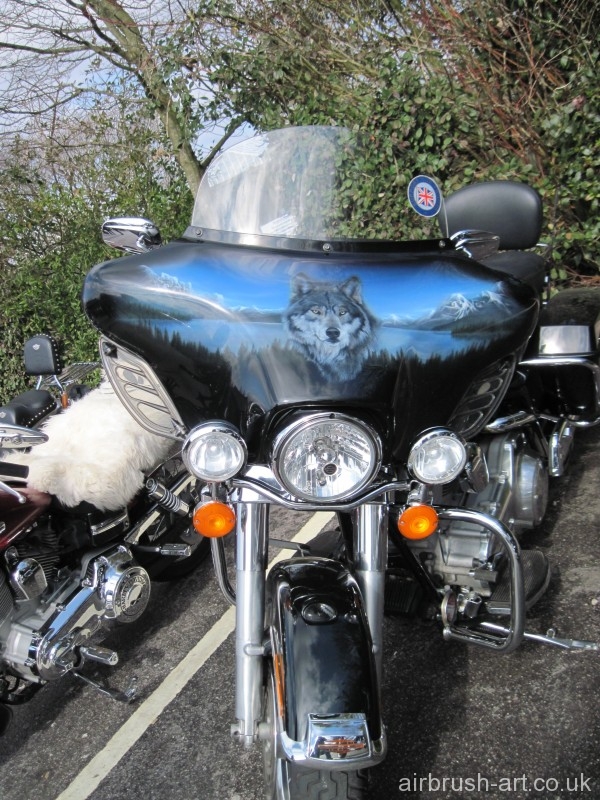
Where is `mirrors`? This screenshot has width=600, height=800. mirrors is located at coordinates (118, 224), (14, 438), (500, 218).